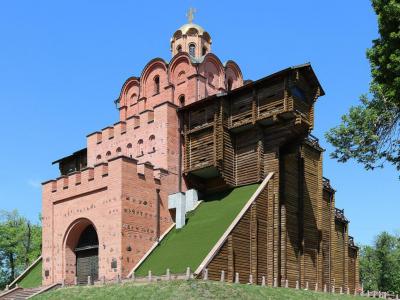
Identify the location of archway. The width and height of the screenshot is (400, 300). (77, 229).